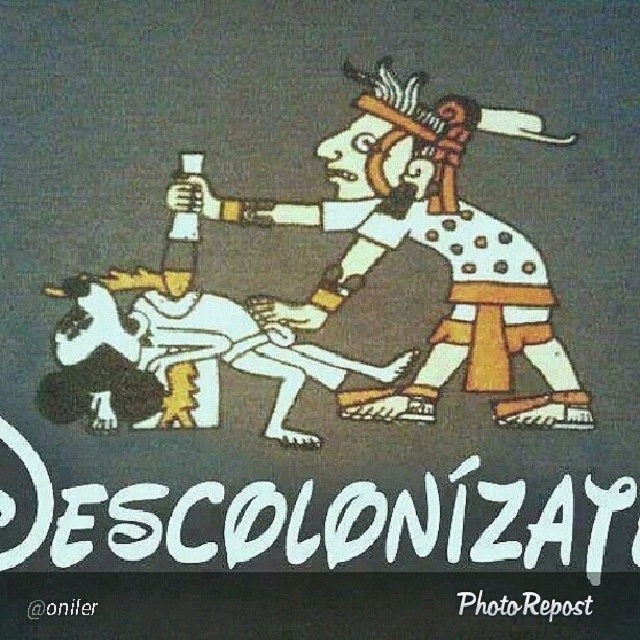
Which is in front, point (476, 216) or point (29, 604)?

Point (29, 604)

Does white matte figure at center have a larger size compared to black paper at lower left?

Yes, white matte figure at center is bigger than black paper at lower left.

Where is `white matte figure at center`? white matte figure at center is located at coordinates (424, 244).

Does white paper text at center have a lesser height compared to white paper at lower center?

Incorrect, white paper text at center's height does not fall short of white paper at lower center's.

Can you confirm if white paper text at center is positioned to the right of white paper at lower center?

Yes, white paper text at center is to the right of white paper at lower center.

Image resolution: width=640 pixels, height=640 pixels. I want to click on white paper text at center, so click(284, 520).

Between white matte figure at center and white paper at lower center, which one has less height?

With less height is white paper at lower center.

What do you see at coordinates (424, 244) in the screenshot? The width and height of the screenshot is (640, 640). I see `white matte figure at center` at bounding box center [424, 244].

Locate an element on the screen. Image resolution: width=640 pixels, height=640 pixels. white matte figure at center is located at coordinates (424, 244).